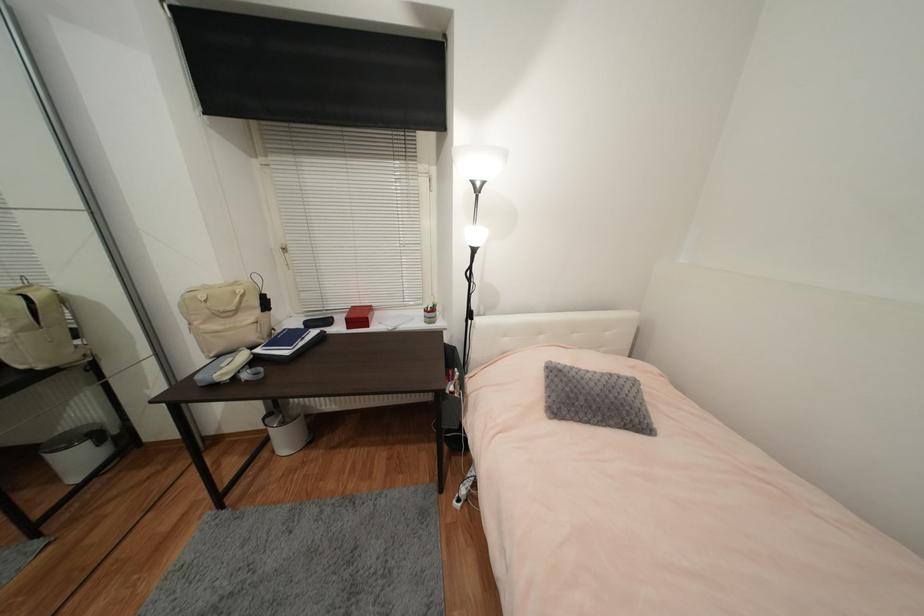
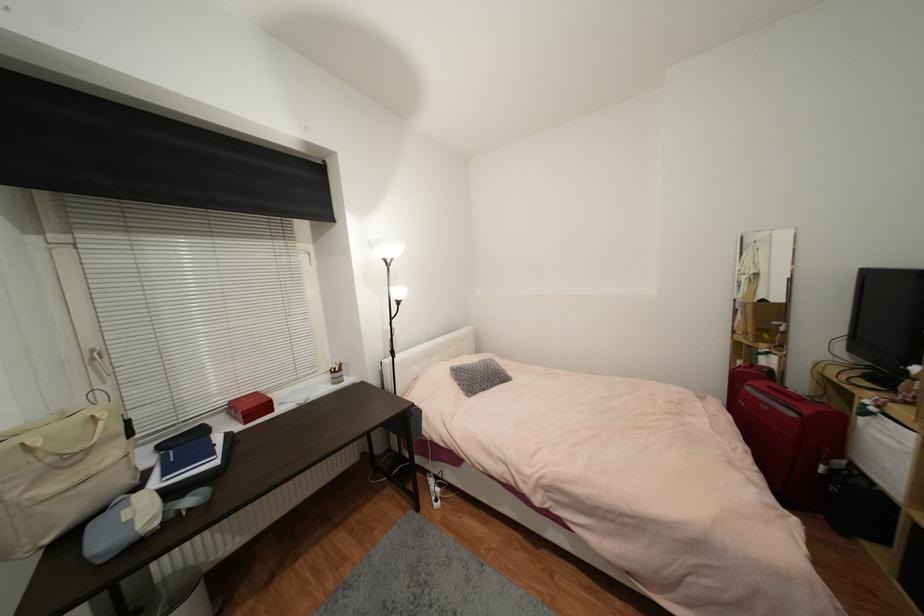
Question: How did the camera likely rotate?

Choices:
 (A) Left
 (B) Right
 (C) Up
 (D) Down

Answer: (B)